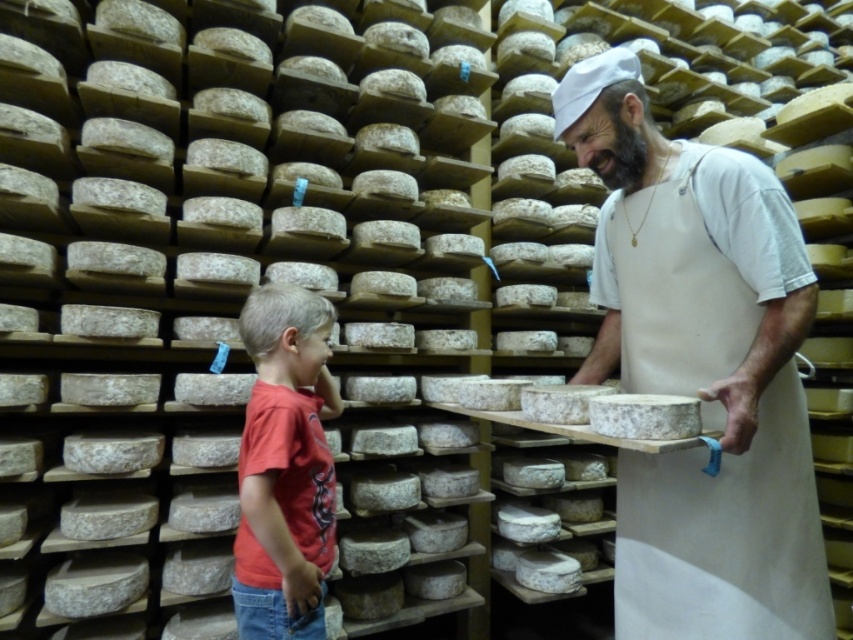
You are a visitor in the cheese aging room and want to take a photo of the smooth white cheese at center without blocking the red cotton shirt at lower left. Can you position yourself in a way that allows you to capture the cheese clearly while keeping the shirt out of the frame?

The smooth white cheese at center is in front of the red cotton shirt at lower left, so if you position yourself behind the cheese, it will block the shirt. To capture the cheese clearly while excluding the shirt, you need to move to a position where the cheese is between you and the shirt. However, since the cheese is already in front of the shirt, you might need to adjust your angle or move around to ensure the shirt isn not in the background.